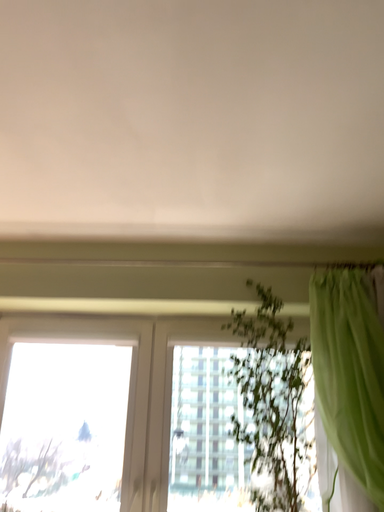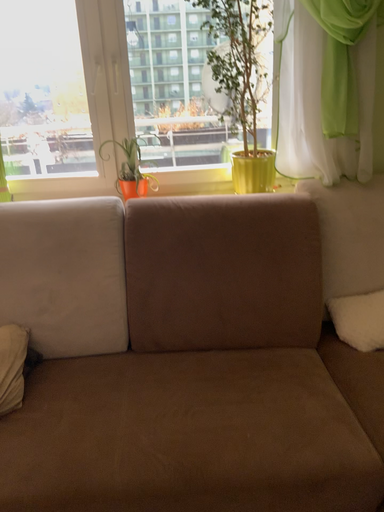
Question: How did the camera likely rotate when shooting the video?

Choices:
 (A) rotated left
 (B) rotated right

Answer: (B)